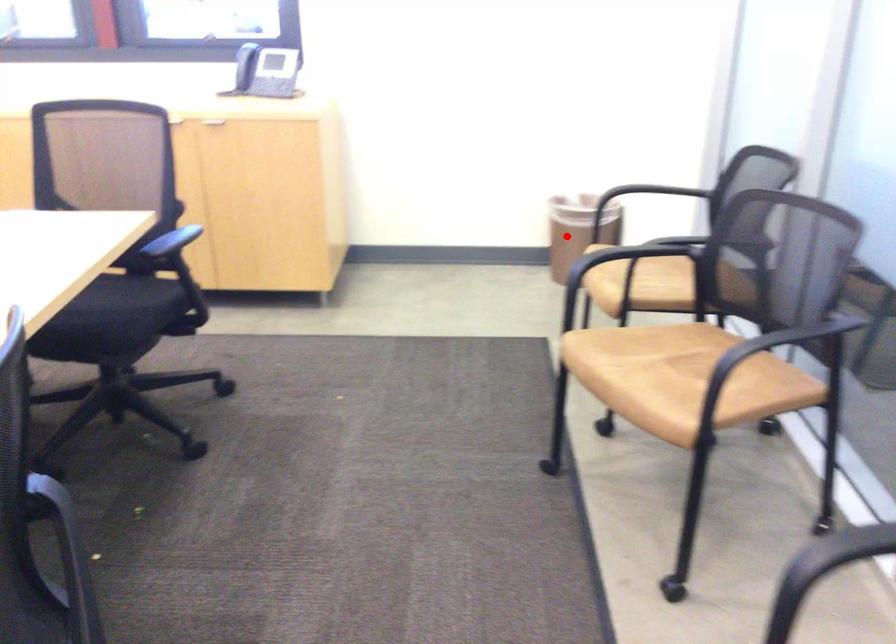
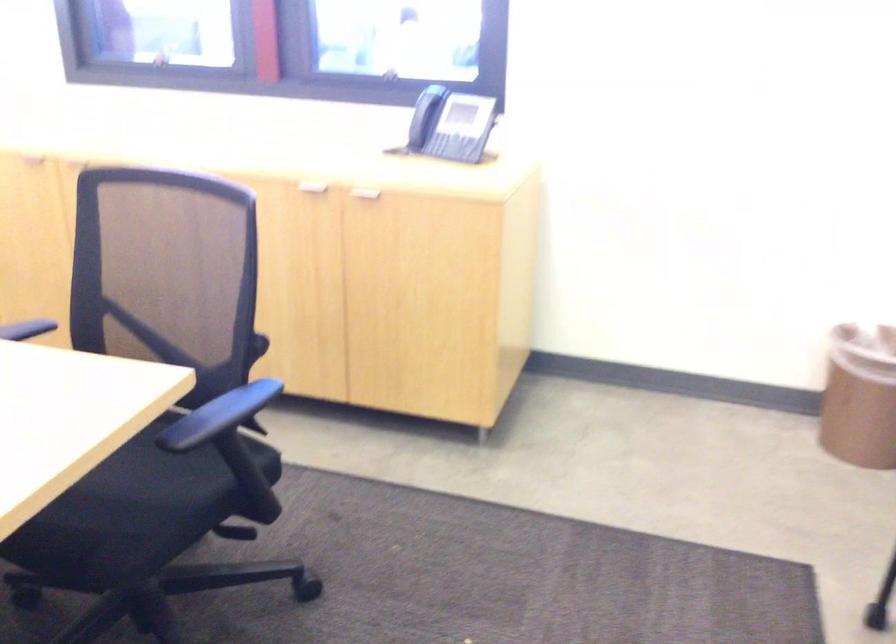
Question: I am providing you with two images of the same scene from different viewpoints. Given a red point in image1, look at the same physical point in image2. Is it:

Choices:
 (A) Closer to the viewpoint
 (B) Farther from the viewpoint

Answer: (A)